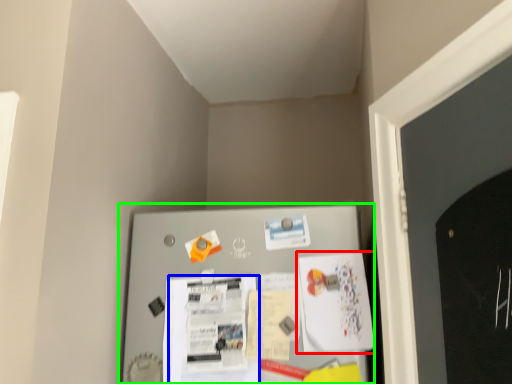
Question: Which object is the farthest from poster (highlighted by a red box)? Choose among these: poster (highlighted by a blue box) or bulletin board (highlighted by a green box).

Choices:
 (A) poster
 (B) bulletin board

Answer: (A)